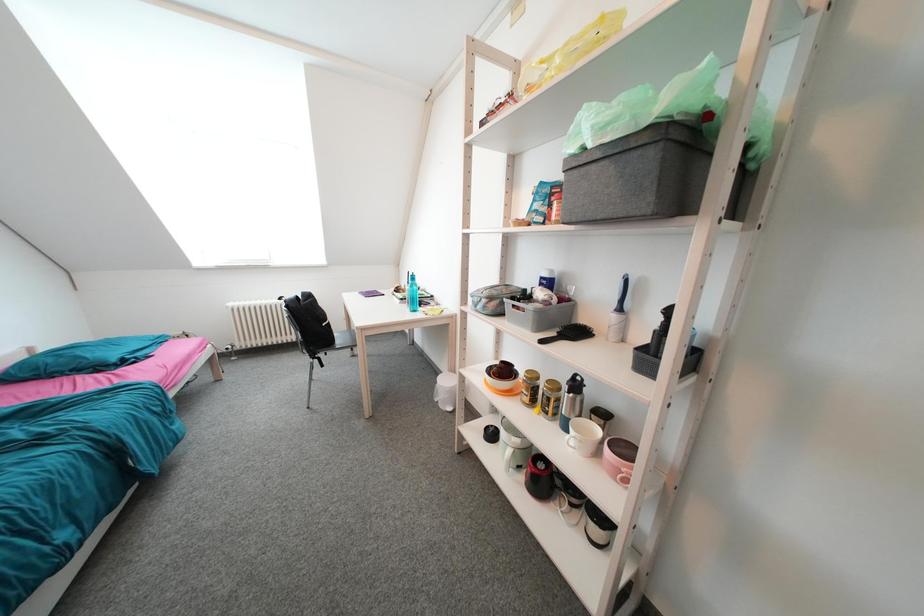
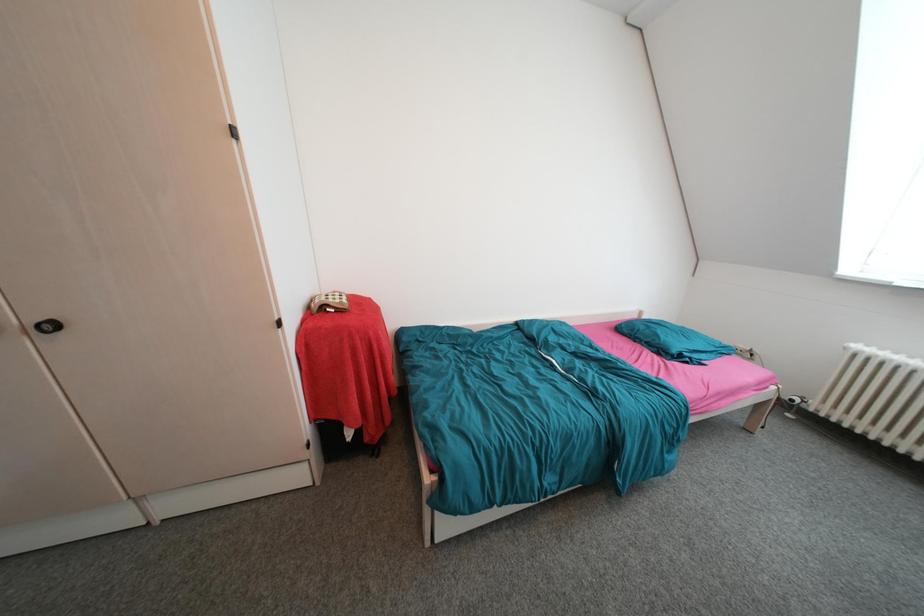
How did the camera likely rotate?

The camera rotated toward left-down.